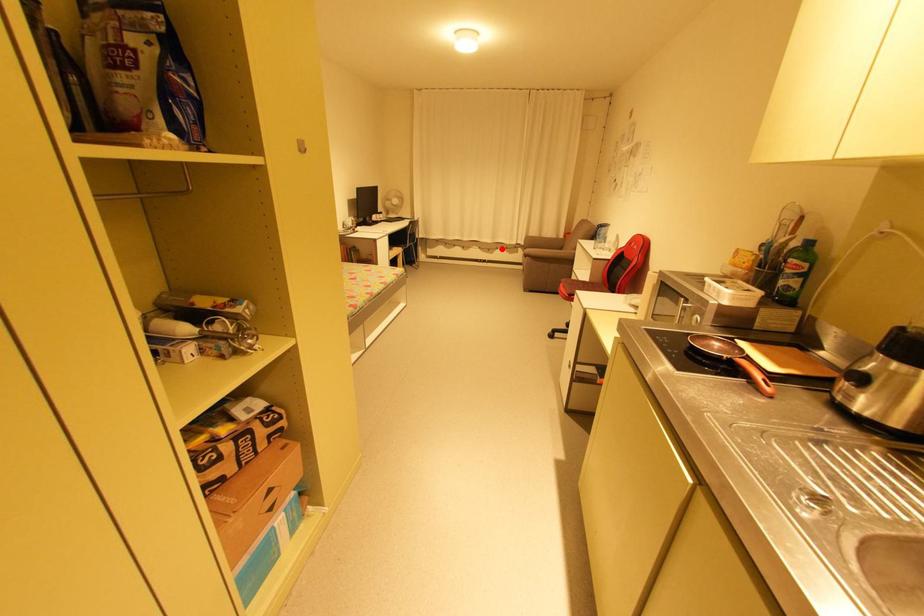
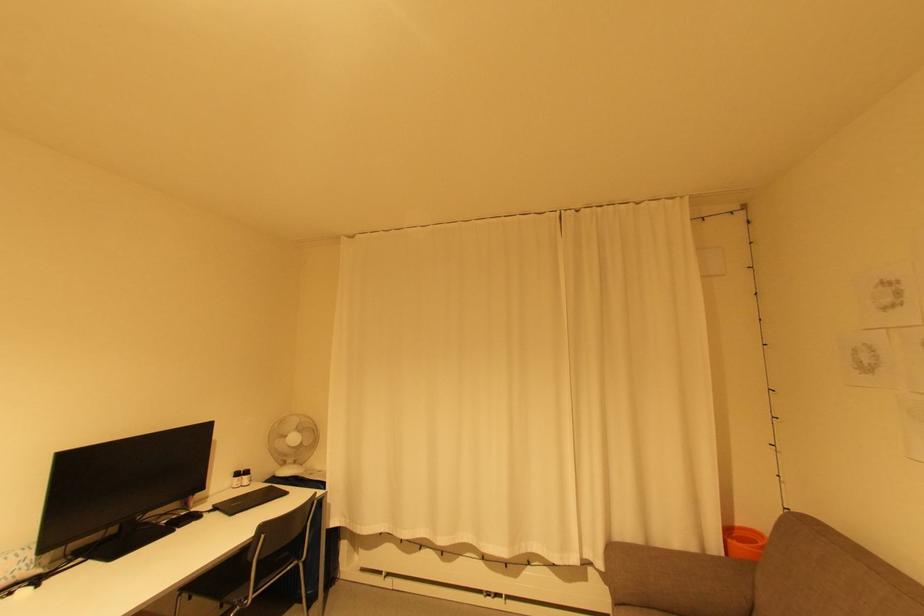
Where in the second image is the point corresponding to the highlighted location from the first image?

(533, 564)